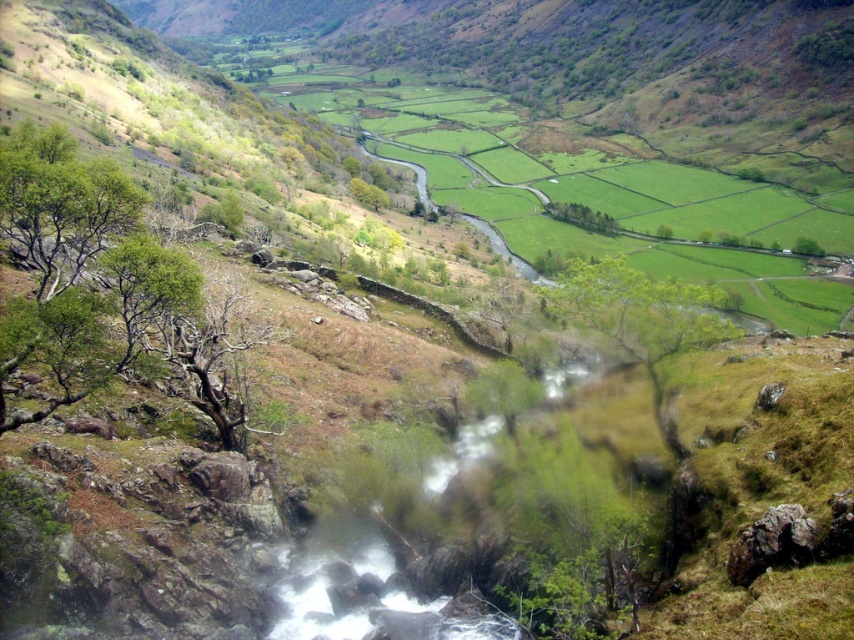
Is point (173, 292) behind point (668, 308)?

No.

Can you confirm if green leafy tree at left is bigger than green leafy tree at center?

Yes.

Does point (13, 150) come closer to viewer compared to point (559, 300)?

Yes, it is in front of point (559, 300).

You are a GUI agent. You are given a task and a screenshot of the screen. Output one action in this format:
    pyautogui.click(x=<x>, y=<y>)
    Task: Click on the green leafy tree at left
    
    Given the screenshot: What is the action you would take?
    pyautogui.click(x=98, y=282)

Who is more forward, (188, 272) or (806, 241)?

Point (188, 272)

Identify the location of green leafy tree at left. The width and height of the screenshot is (854, 640). (98, 282).

Can you confirm if green leafy tree at center is positioned above green leafy tree at center-right?

Actually, green leafy tree at center is below green leafy tree at center-right.

Which is more to the left, green leafy tree at center or green leafy tree at center-right?

green leafy tree at center is more to the left.

Is point (630, 349) less distant than point (799, 253)?

That is True.

The width and height of the screenshot is (854, 640). Find the location of `green leafy tree at center`. green leafy tree at center is located at coordinates (642, 321).